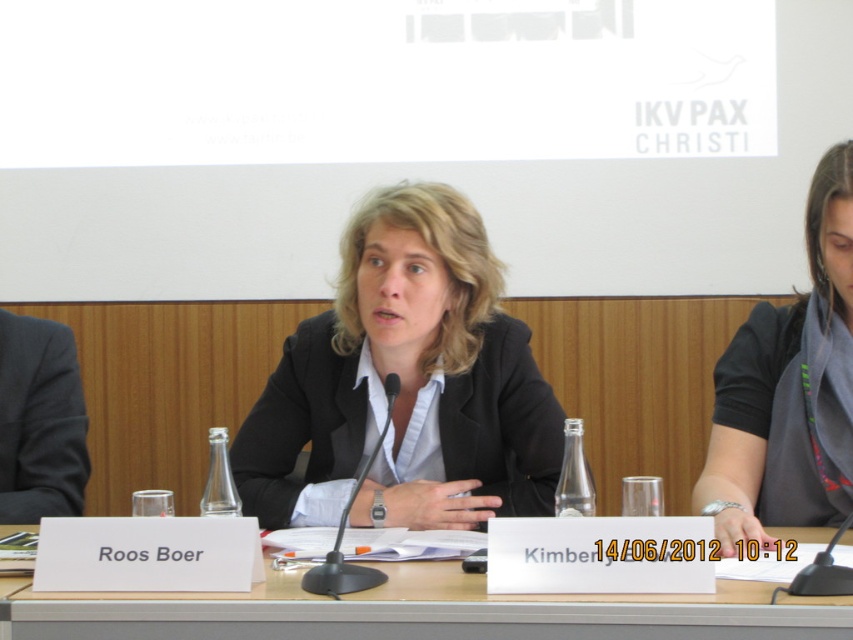
Describe the element at coordinates (405, 384) in the screenshot. This screenshot has width=853, height=640. I see `black matte blazer at center` at that location.

Can you confirm if black matte blazer at center is shorter than wooden table at center?

In fact, black matte blazer at center may be taller than wooden table at center.

Which is behind, point (305, 515) or point (263, 611)?

The point (305, 515) is behind.

At what (x,y) coordinates should I click in order to perform the action: click on black matte blazer at center. Please return your answer as a coordinate pair (x, y). Looking at the image, I should click on (405, 384).

Is the position of black matte blazer at center more distant than that of black fabric shirt at center?

Yes, it is behind black fabric shirt at center.

Measure the distance between point (323, 355) and camera.

Point (323, 355) is 5.79 feet away from camera.

Locate an element on the screen. black matte blazer at center is located at coordinates (405, 384).

Identify the location of black matte blazer at center. The height and width of the screenshot is (640, 853). (405, 384).

Does wooden table at center appear on the right side of black fabric shirt at center?

In fact, wooden table at center is to the left of black fabric shirt at center.

Between wooden table at center and black fabric shirt at center, which one appears on the right side from the viewer's perspective?

Positioned to the right is black fabric shirt at center.

Is point (321, 605) in front of point (735, 332)?

Yes, it is in front of point (735, 332).

The image size is (853, 640). I want to click on wooden table at center, so click(422, 611).